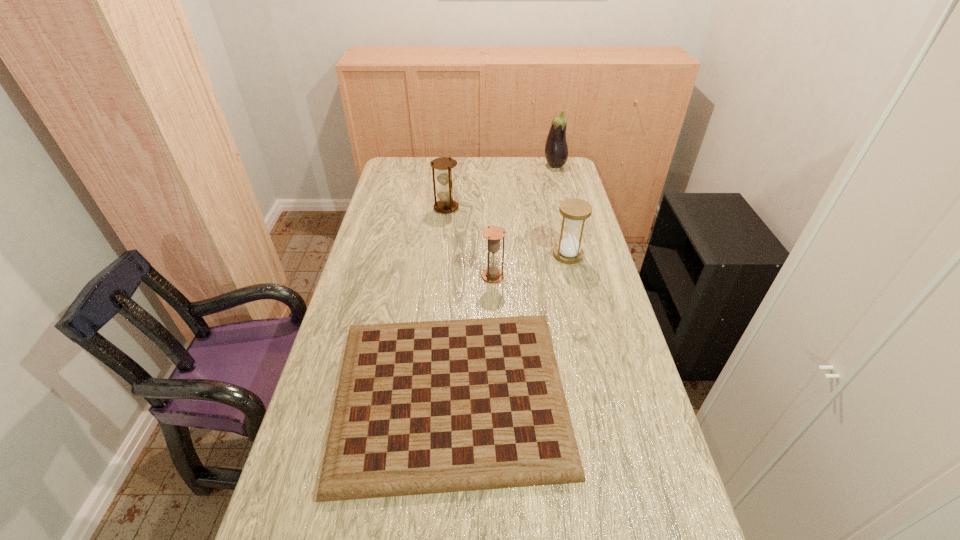
What are the coordinates of `free region at the far edge of the desktop` in the screenshot? It's located at tap(470, 159).

The image size is (960, 540). Identify the location of vacant space at the left edge. (383, 232).

You are a GUI agent. You are given a task and a screenshot of the screen. Output one action in this format:
    pyautogui.click(x=<x>, y=<y>)
    Task: Click on the vacant space at the right edge
    
    Given the screenshot: What is the action you would take?
    pyautogui.click(x=581, y=261)

I want to click on free space at the far left corner, so click(x=403, y=170).

Find the location of a particular element. This screenshot has width=960, height=540. free space at the far right corner of the desktop is located at coordinates (549, 170).

This screenshot has height=540, width=960. Find the location of `free space between the eggplant and the gameboard`. free space between the eggplant and the gameboard is located at coordinates (503, 280).

Where is `empty location between the third nearest object and the farthest hourglass`? empty location between the third nearest object and the farthest hourglass is located at coordinates (507, 231).

Locate an element on the screen. The image size is (960, 540). vacant space that is in between the leftmost hourglass and the nearest hourglass is located at coordinates (469, 242).

Image resolution: width=960 pixels, height=540 pixels. What are the coordinates of `free space that is in between the nearest object and the farthest hourglass` in the screenshot? It's located at (448, 301).

Find the location of a particular element. vacant area that lies between the shortest object and the tallest object is located at coordinates (503, 280).